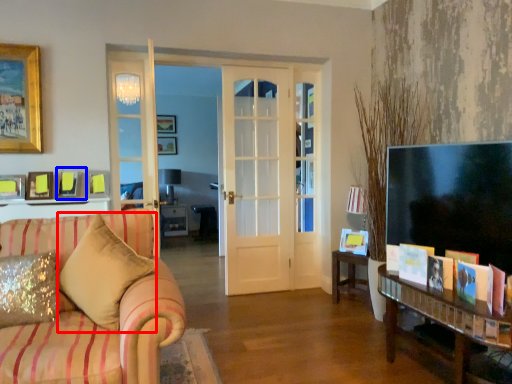
Question: Which object is further to the camera taking this photo, pillow (highlighted by a red box) or picture frame (highlighted by a blue box)?

Choices:
 (A) pillow
 (B) picture frame

Answer: (B)